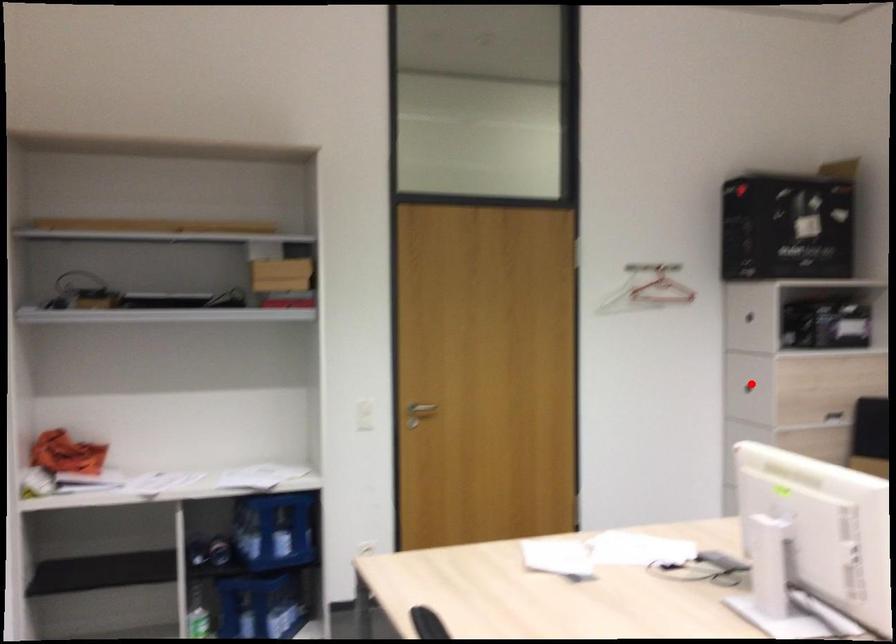
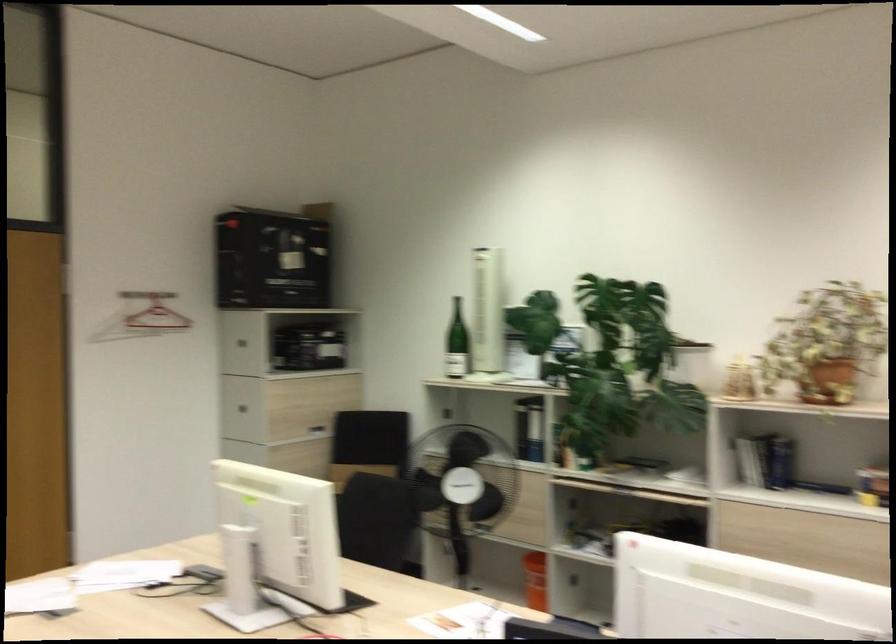
The point at the highlighted location is marked in the first image. Where is the corresponding point in the second image?

(244, 402)